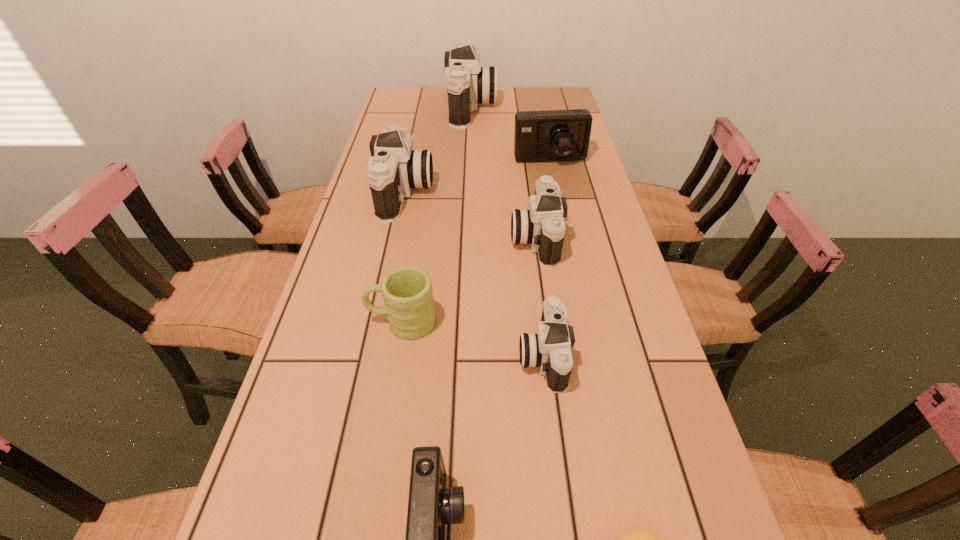
The height and width of the screenshot is (540, 960). Identify the location of free region located 0.160m on the left of the biggest black camera. (406, 109).

Locate an element on the screen. free spot located on the right of the third smallest black camera is located at coordinates click(x=506, y=193).

At what (x,y) coordinates should I click in order to perform the action: click on vacant space located 0.190m on the front-facing side of the farther blue camera. Please return your answer as a coordinate pair (x, y). This screenshot has height=540, width=960. Looking at the image, I should click on (559, 205).

Where is `vacant space located on the back of the third biggest black camera`? vacant space located on the back of the third biggest black camera is located at coordinates (530, 198).

Identify the location of free region located on the side of the mug with the handle. (332, 322).

The image size is (960, 540). What are the coordinates of `vacant area situated 0.060m on the side of the mug with the handle` in the screenshot? It's located at (341, 322).

Locate an element on the screen. vacant space situated on the side of the mug with the handle is located at coordinates (336, 322).

In order to click on vacant point located on the back of the second nearest camera in this screenshot , I will do `click(530, 249)`.

Locate an element on the screen. This screenshot has height=540, width=960. object positioned at the far edge is located at coordinates (468, 83).

The width and height of the screenshot is (960, 540). In order to click on camera that is at the left edge in this screenshot , I will do `click(395, 169)`.